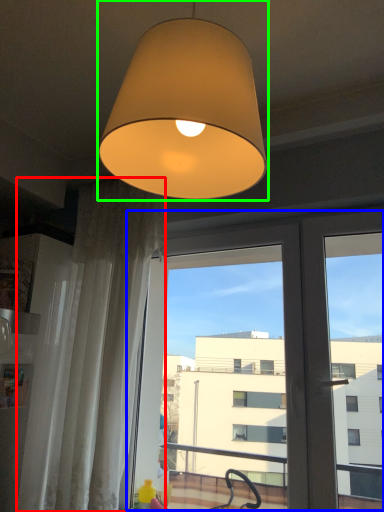
Question: Which is farther away from curtain (highlighted by a red box)? screen door (highlighted by a blue box) or lamp (highlighted by a green box)?

Choices:
 (A) screen door
 (B) lamp

Answer: (B)